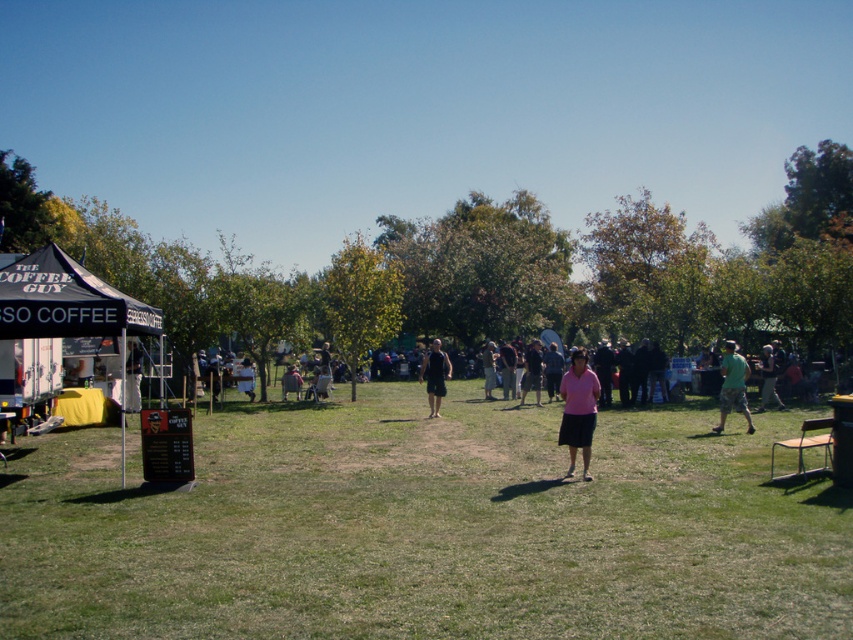
Question: Which object is closer to the camera taking this photo?

Choices:
 (A) black matte shirt at center
 (B) light brown wooden chair at center

Answer: (A)

Question: Is black fabric tent at left smaller than pink fabric skirt at center?

Choices:
 (A) no
 (B) yes

Answer: (A)

Question: Which point is closer to the camera taking this photo?

Choices:
 (A) (428, 360)
 (B) (283, 388)

Answer: (A)

Question: Can you confirm if black fabric tent at left is positioned below pink fabric shirt at center?

Choices:
 (A) no
 (B) yes

Answer: (A)

Question: Which object is positioned farthest from the green cotton shirt at right?

Choices:
 (A) pink fabric skirt at center
 (B) pink fabric shirt at center

Answer: (B)

Question: Is green cotton shirt at right positioned at the back of black matte shirt at center?

Choices:
 (A) no
 (B) yes

Answer: (A)